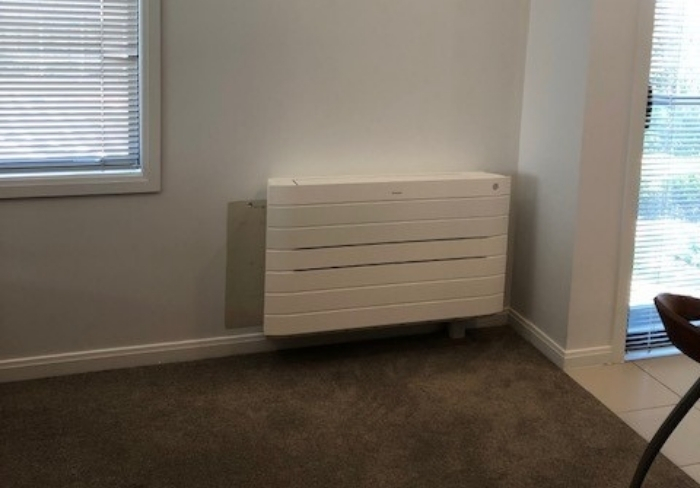
The image size is (700, 488). I want to click on glass door with white blinds, so click(x=670, y=147).